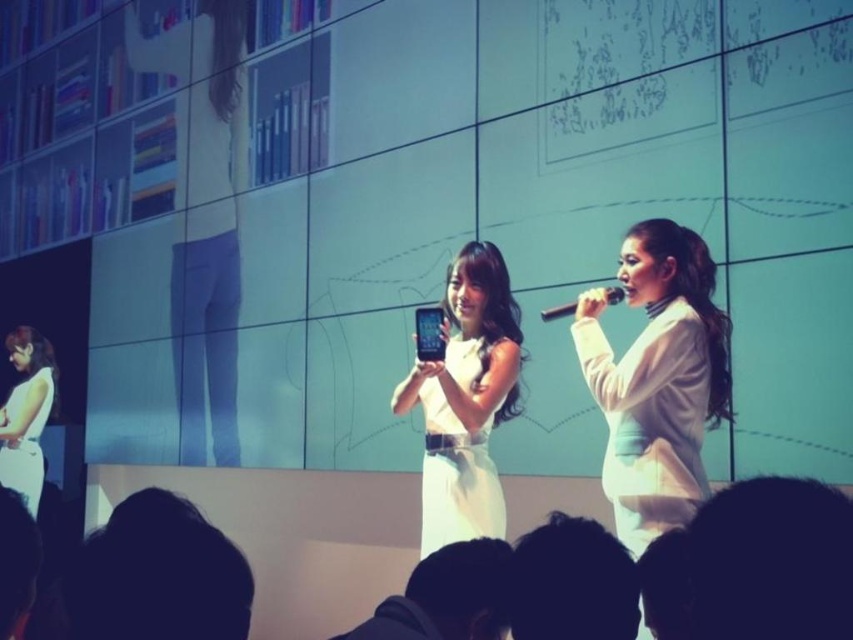
You are an audience member sitting in the front row. You notice two items on stage that are both white in color. One is the dark hair at lower center and the other is the black plastic microphone at center. Which of these two items is narrower?

The dark hair at lower center has a lesser width compared to the black plastic microphone at center, so the dark hair at lower center is narrower.

In the scene shown: You are an audience member sitting in the front row. You notice the dark hair at lower center and the black plastic microphone at center. Which object is positioned closer to you?

The dark hair at lower center is closer to the viewer than the black plastic microphone at center.